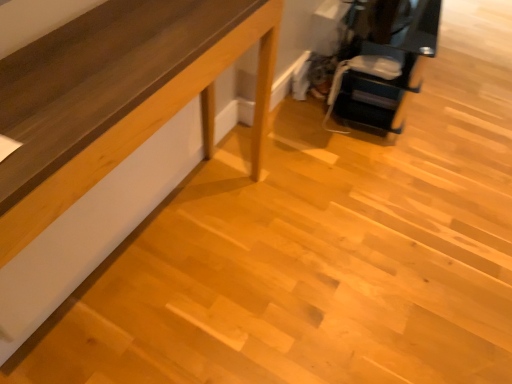
Where is `free space that is in between matte black printer at upper right, marked as the 2th furniture in a bottom-to-top arrangement, and light brown wood table at lower left, which is the second furniture in top-to-bottom order`? free space that is in between matte black printer at upper right, marked as the 2th furniture in a bottom-to-top arrangement, and light brown wood table at lower left, which is the second furniture in top-to-bottom order is located at coordinates (239, 189).